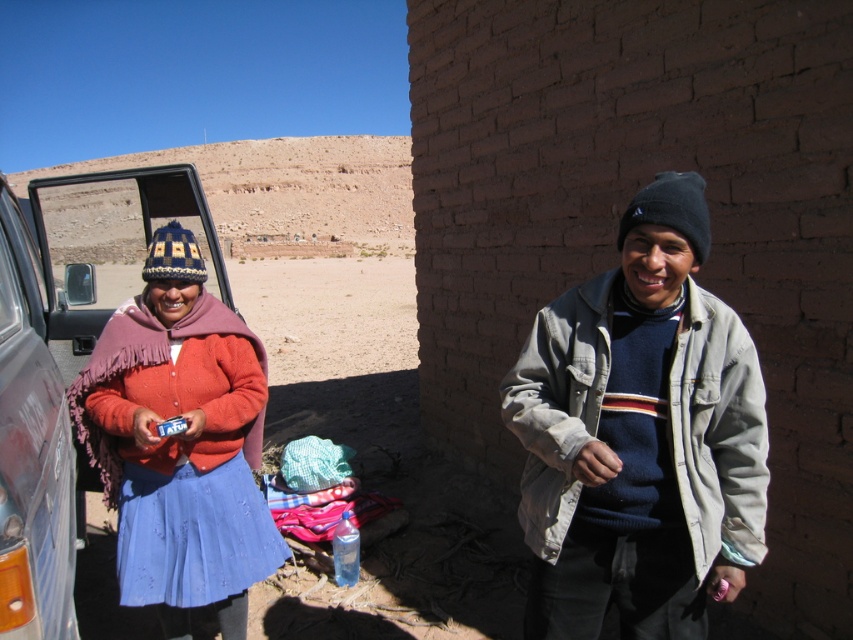
You are a photographer trying to capture a photo of the light gray cotton jacket at right and the knitted woolen hat at left. Since you want to focus on the jacket, which object should you adjust your camera to focus on first, considering their positions?

The light gray cotton jacket at right is above the knitted woolen hat at left, so you should focus on the light gray cotton jacket at right first as it is higher up in the frame.

You are a photographer trying to capture both the light gray cotton jacket at right and the metallic gray suv at left in the same frame. Based on their sizes, which object should you focus on first to ensure both fit in the photo?

The light gray cotton jacket at right has a lesser width compared to the metallic gray suv at left, so you should focus on the metallic gray suv at left first since it is larger and requires more space in the frame to ensure both fit properly.

You are navigating through the desert and need to reach a hidden oasis located at point (202, 566). There is an obstacle at point (642, 476) blocking your path. Can you safely go around the obstacle to reach the oasis?

Point (642, 476) is in front of point (202, 566), so the obstacle is blocking the direct path. You will need to find an alternative route around the obstacle to reach the oasis safely.